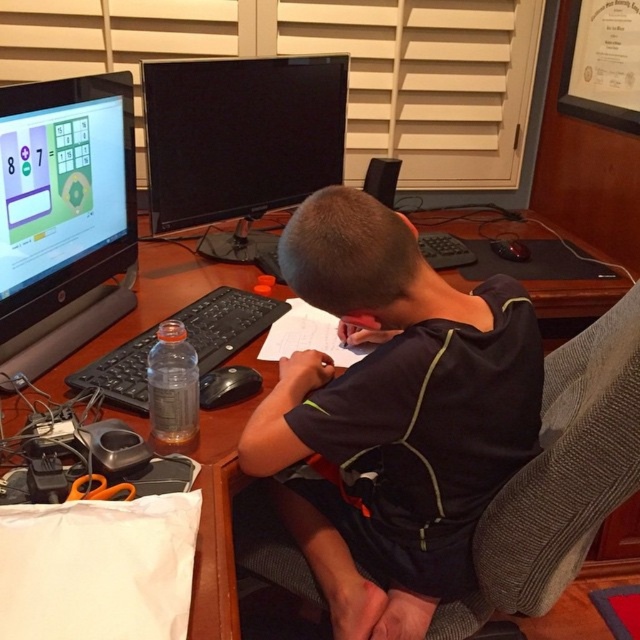
You need to place a rectangular box that is 1.2 meters wide on the desk. Given the dark blue jersey at center and the black glossy monitor at center, which object must you move to make space?

The dark blue jersey at center must be moved because its width is greater than the black glossy monitor at center, meaning it occupies more space on the desk. Since the box is 1.2 meters wide, moving the larger object would free up enough space.